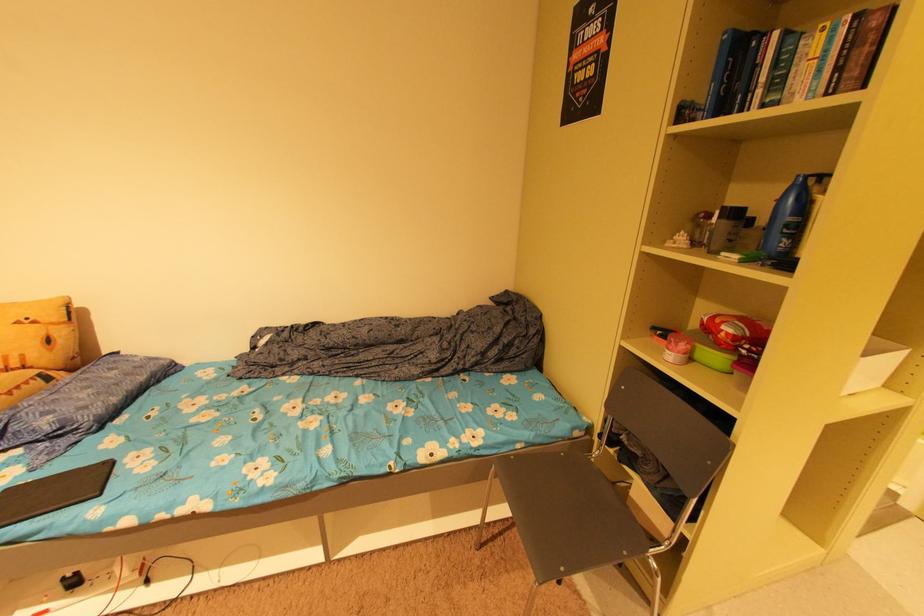
The location [54,492] corresponds to which object?

It corresponds to the black book in the image.